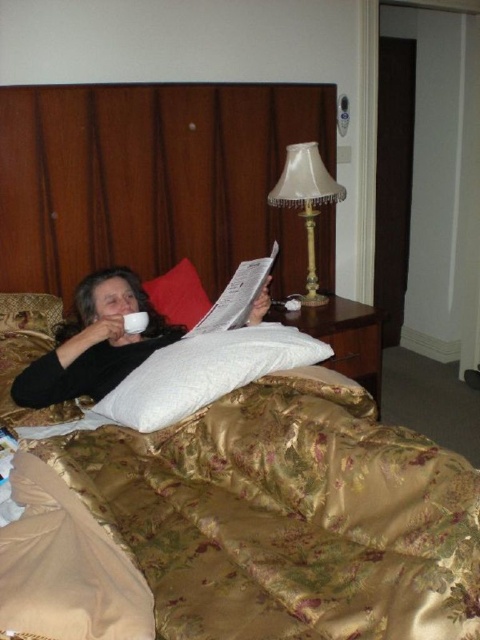
Is point (231, 458) less distant than point (215, 304)?

Yes, point (231, 458) is in front of point (215, 304).

Does gold satin bed at center have a larger size compared to white paper magazine at center?

Yes, gold satin bed at center is bigger than white paper magazine at center.

You are a GUI agent. You are given a task and a screenshot of the screen. Output one action in this format:
    pyautogui.click(x=<x>, y=<y>)
    Task: Click on the gold satin bed at center
    
    Given the screenshot: What is the action you would take?
    pyautogui.click(x=260, y=524)

Does matte black cup at upper left have a lesser width compared to white paper magazine at center?

No, matte black cup at upper left is not thinner than white paper magazine at center.

In the scene shown: Between matte black cup at upper left and white paper magazine at center, which one appears on the right side from the viewer's perspective?

Positioned to the right is white paper magazine at center.

Between point (107, 392) and point (264, 260), which one is positioned in front?

Point (107, 392) is more forward.

The image size is (480, 640). In order to click on matte black cup at upper left in this screenshot , I will do `click(96, 342)`.

Is gold satin bed at center in front of red velvet pillow at center?

Yes.

Between gold satin bed at center and red velvet pillow at center, which one has less height?

red velvet pillow at center

Which is behind, point (457, 468) or point (168, 289)?

Point (168, 289)

You are a GUI agent. You are given a task and a screenshot of the screen. Output one action in this format:
    pyautogui.click(x=<x>, y=<y>)
    Task: Click on the gold satin bed at center
    
    Given the screenshot: What is the action you would take?
    pyautogui.click(x=260, y=524)